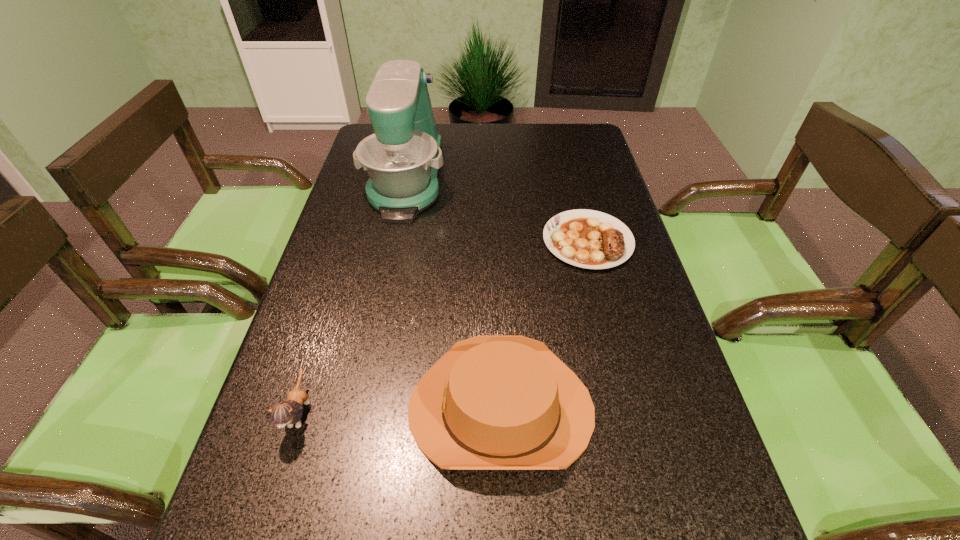
Identify the location of the third closest object to the kitten. (590, 239).

Where is `free space that satisfies the following two spatial constraints: 1. on the front-facing side of the cowboy hat; 2. on the front-facing side of the kitten`? free space that satisfies the following two spatial constraints: 1. on the front-facing side of the cowboy hat; 2. on the front-facing side of the kitten is located at coordinates (501, 412).

You are a GUI agent. You are given a task and a screenshot of the screen. Output one action in this format:
    pyautogui.click(x=<x>, y=<y>)
    Task: Click on the vacant space that satisfies the following two spatial constraints: 1. on the front-facing side of the shortest object; 2. on the right side of the tallest object
    
    Given the screenshot: What is the action you would take?
    pyautogui.click(x=394, y=241)

You are a GUI agent. You are given a task and a screenshot of the screen. Output one action in this format:
    pyautogui.click(x=<x>, y=<y>)
    Task: Click on the blank area in the image that satisfies the following two spatial constraints: 1. on the front-facing side of the shortest object; 2. on the left side of the tallest object
    This screenshot has height=540, width=960.
    Given the screenshot: What is the action you would take?
    pyautogui.click(x=394, y=241)

Where is `free spot that satisfies the following two spatial constraints: 1. on the front-facing side of the cowboy hat; 2. on the front-facing side of the kitten`? The height and width of the screenshot is (540, 960). free spot that satisfies the following two spatial constraints: 1. on the front-facing side of the cowboy hat; 2. on the front-facing side of the kitten is located at coordinates (501, 412).